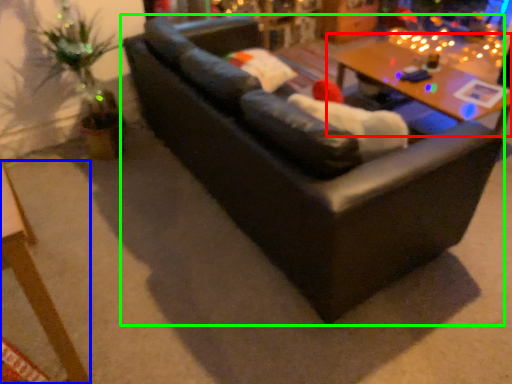
Question: Which object is the farthest from table (highlighted by a red box)? Choose among these: table (highlighted by a blue box) or studio couch (highlighted by a green box).

Choices:
 (A) table
 (B) studio couch

Answer: (A)